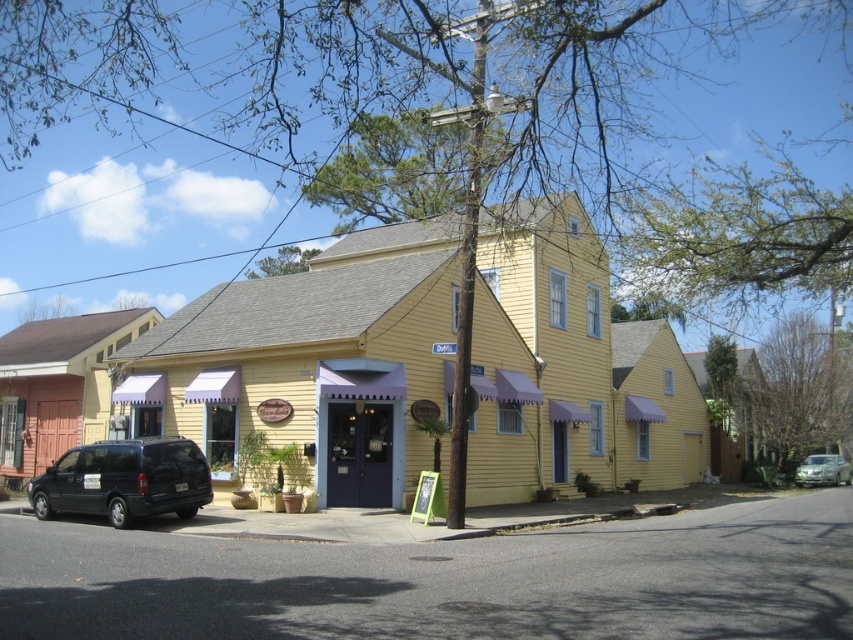
Does point (105, 444) lie in front of point (815, 465)?

Yes, point (105, 444) is closer to viewer.

Who is positioned more to the left, matte black van at lower left or metallic silver sedan at lower right?

matte black van at lower left

Is point (115, 502) behind point (845, 460)?

No.

Identify the location of matte black van at lower left. This screenshot has width=853, height=640. (125, 481).